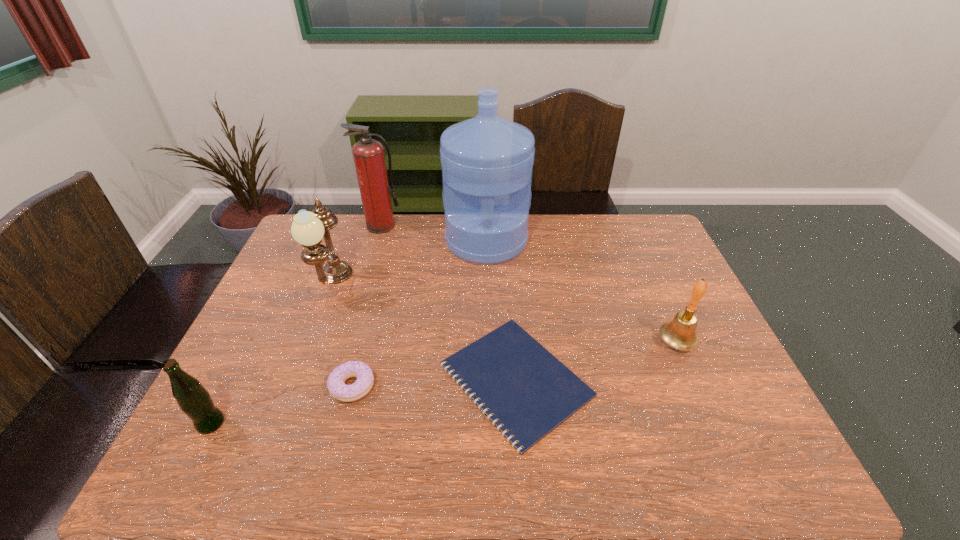
Where is `blank area located 0.170m on the back of the rightmost object`? The image size is (960, 540). blank area located 0.170m on the back of the rightmost object is located at coordinates (653, 288).

At what (x,y) coordinates should I click in order to perform the action: click on free spot located on the back of the leftmost object. Please return your answer as a coordinate pair (x, y). Image resolution: width=960 pixels, height=540 pixels. Looking at the image, I should click on (257, 333).

This screenshot has width=960, height=540. I want to click on free space located on the back of the doughnut, so click(x=378, y=288).

This screenshot has width=960, height=540. What are the coordinates of `vacant region located 0.280m on the right of the shortest object` in the screenshot? It's located at (704, 380).

Image resolution: width=960 pixels, height=540 pixels. I want to click on water jug that is positioned at the far edge, so coord(487,161).

Find the location of a particular element. fire extinguisher present at the far edge is located at coordinates (368, 154).

Image resolution: width=960 pixels, height=540 pixels. Identify the location of object that is positioned at the near edge. (529, 391).

The height and width of the screenshot is (540, 960). I want to click on oil lamp at the left edge, so click(308, 228).

What are the coordinates of `beer bottle at the left edge` in the screenshot? It's located at (194, 400).

Where is `object at the right edge`? This screenshot has height=540, width=960. object at the right edge is located at coordinates (680, 333).